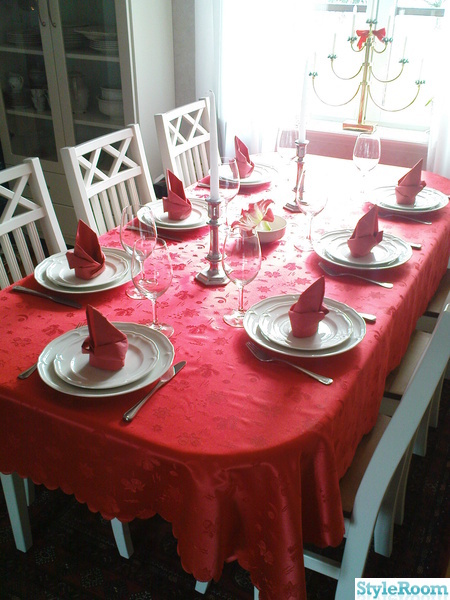
Where is `7 saucers`? The height and width of the screenshot is (600, 450). 7 saucers is located at coordinates (103, 381), (296, 341), (369, 254), (412, 204), (259, 172), (182, 219), (100, 281).